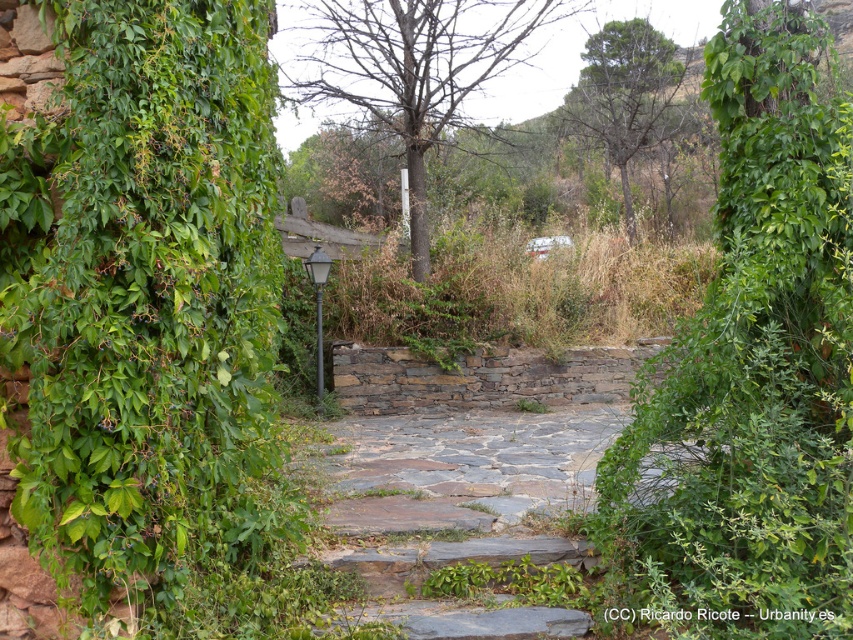
You are a gardener who wants to trim the green leafy hedge at center and the gray stone steps at center. Based on their heights, which one do you think requires more time to trim?

The green leafy hedge at center is much taller than the gray stone steps at center, so it will require more time to trim.